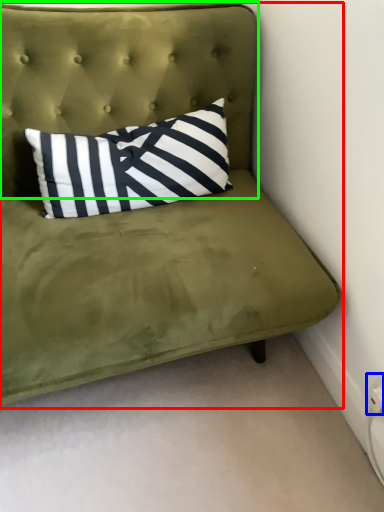
Question: Which object is the farthest from studio couch (highlighted by a red box)? Choose among these: electric outlet (highlighted by a blue box) or headboard (highlighted by a green box).

Choices:
 (A) electric outlet
 (B) headboard

Answer: (A)